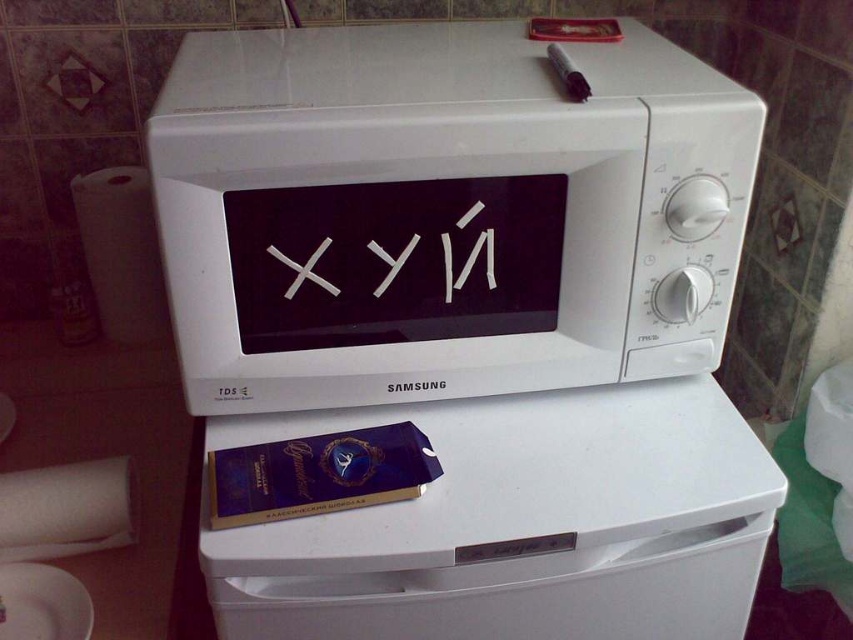
You are a delivery person who just delivered a new microwave. You need to place it on top of the existing microwave. Can you fit the new white matte microwave at center on top of the white plastic microwave at upper center?

The white matte microwave at center is bigger than the white plastic microwave at upper center, so it cannot be placed on top of it because it is larger and would not fit.

You are a delivery person who just delivered a white matte microwave at center and a white plastic microwave at upper center to a customer. The customer wants to place both microwaves in their kitchen. However, there is only one spot available. Which microwave should they place in the spot if the spot is wider than the other microwave?

The white matte microwave at center might be wider than the white plastic microwave at upper center, so the customer should place the white matte microwave at center in the wider spot to ensure it fits properly.

What are the coordinates of the white matte microwave at center in the image?

The white matte microwave at center is located at point (444, 212).